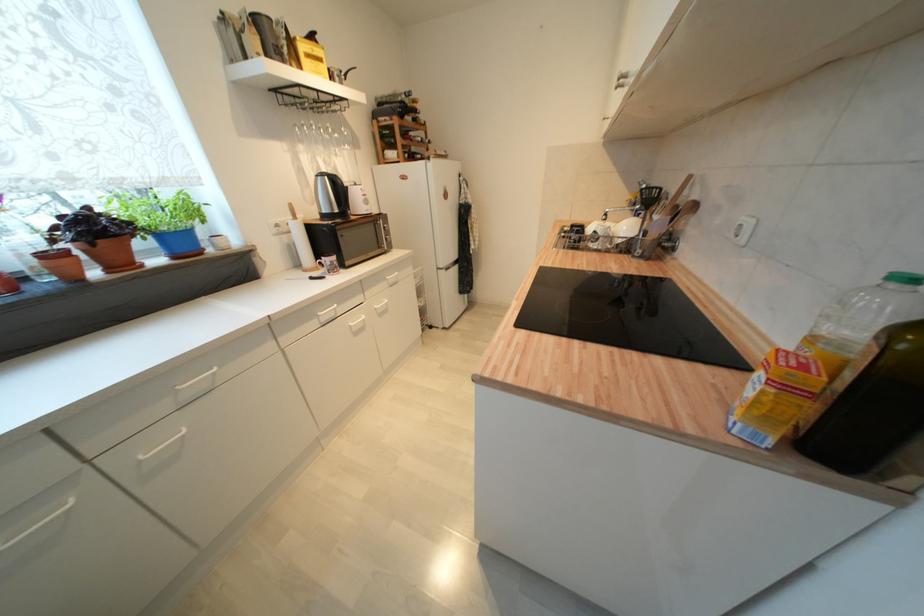
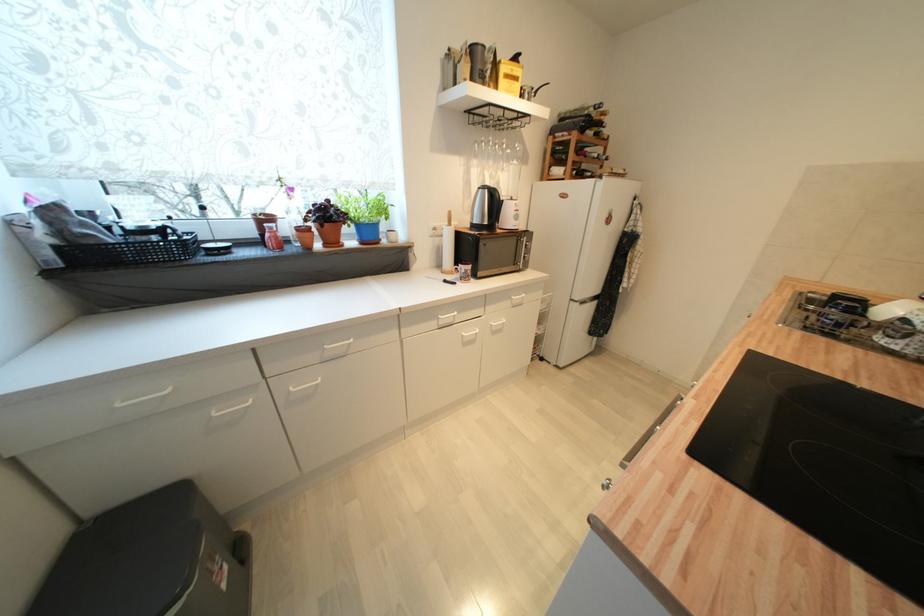
The point at (359, 331) is marked in the first image. Where is the corresponding point in the second image?

(469, 342)